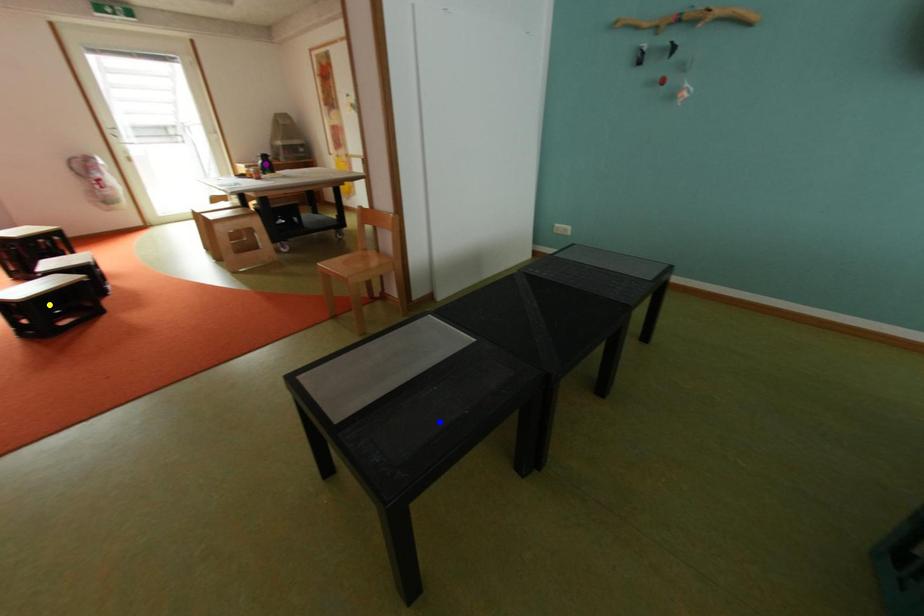
Order these from nearest to farthest:
yellow point
blue point
purple point

blue point → yellow point → purple point